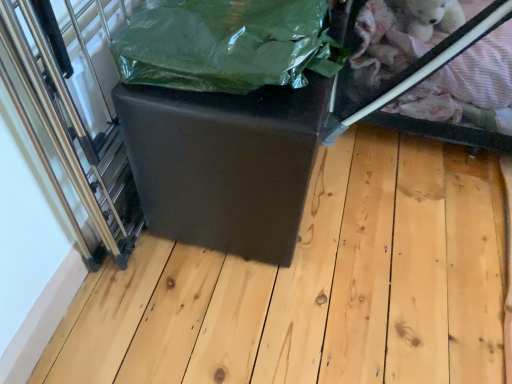
At what (x,y) coordinates should I click in order to perform the action: click on vacant point above matte black ottoman at center (from a real-world perspective). Please return your answer as a coordinate pair (x, y). This screenshot has width=512, height=384. Looking at the image, I should click on (316, 299).